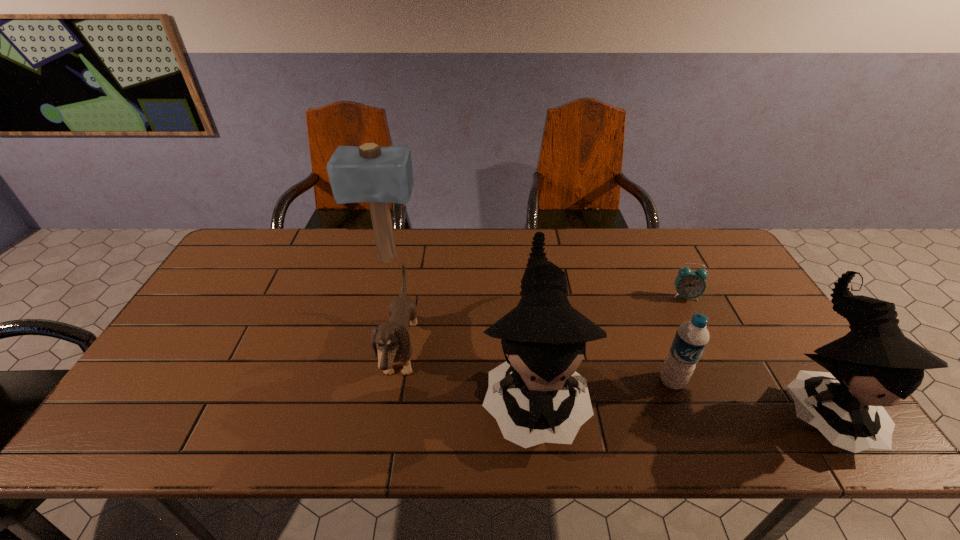
Given the evenly spaced dolls in the image, where should an extra doll be added on the left to preserve the spacing? Please point to a vacant space. Please provide its 2D coordinates. Your answer should be formatted as a tuple, i.e. [(x, y)], where the tuple contains the x and y coordinates of a point satisfying the conditions above.

[(262, 381)]